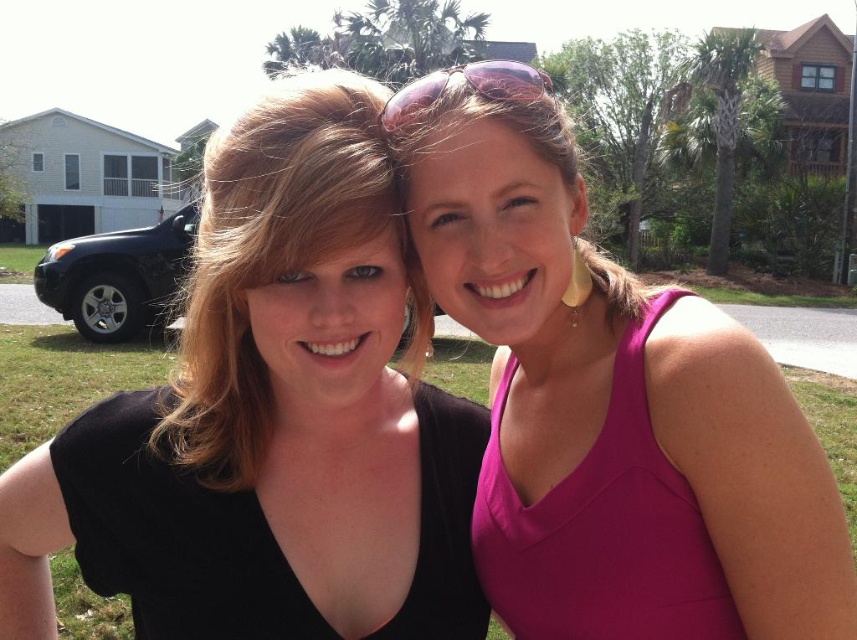
Question: Is black matte tank top at center further to camera compared to black matte dress at left?

Choices:
 (A) yes
 (B) no

Answer: (B)

Question: Among these points, which one is nearest to the camera?

Choices:
 (A) [x=649, y=449]
 (B) [x=213, y=493]

Answer: (A)

Question: Which point is farther to the camera?

Choices:
 (A) fuchsia fabric tank top at right
 (B) black matte dress at left
 (C) pink matte tank top at center

Answer: (B)

Question: From the image, what is the correct spatial relationship of black matte tank top at center in relation to fuchsia fabric tank top at right?

Choices:
 (A) right
 (B) left

Answer: (B)

Question: Among these points, which one is farthest from the camera?

Choices:
 (A) (795, 634)
 (B) (171, 595)
 (C) (650, 589)
 (D) (444, 440)

Answer: (D)

Question: Is black matte tank top at center wider than black matte dress at left?

Choices:
 (A) no
 (B) yes

Answer: (B)